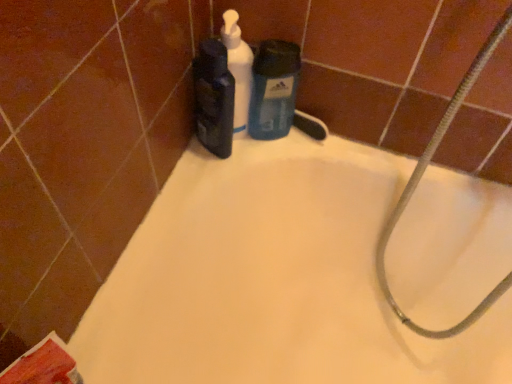
Question: Is white matte bathtub at upper center closer to camera compared to silvery metallic hose at upper right?

Choices:
 (A) no
 (B) yes

Answer: (A)

Question: From the image's perspective, is white matte bathtub at upper center located beneath silvery metallic hose at upper right?

Choices:
 (A) yes
 (B) no

Answer: (A)

Question: Does white matte bathtub at upper center touch silvery metallic hose at upper right?

Choices:
 (A) no
 (B) yes

Answer: (A)

Question: Could you tell me if white matte bathtub at upper center is turned towards silvery metallic hose at upper right?

Choices:
 (A) no
 (B) yes

Answer: (A)

Question: Is white matte bathtub at upper center outside of silvery metallic hose at upper right?

Choices:
 (A) yes
 (B) no

Answer: (A)

Question: From a real-world perspective, is white matte bathtub at upper center positioned above or below silvery metallic hose at upper right?

Choices:
 (A) below
 (B) above

Answer: (A)

Question: In terms of width, does white matte bathtub at upper center look wider or thinner when compared to silvery metallic hose at upper right?

Choices:
 (A) wide
 (B) thin

Answer: (A)

Question: Visually, is white matte bathtub at upper center positioned to the left or to the right of silvery metallic hose at upper right?

Choices:
 (A) left
 (B) right

Answer: (A)

Question: Which is correct: white matte bathtub at upper center is inside silvery metallic hose at upper right, or outside of it?

Choices:
 (A) inside
 (B) outside

Answer: (B)

Question: Looking at the image, does matte black bottle at upper center, acting as the first cleaning product starting from the left, seem bigger or smaller compared to white matte bathtub at upper center?

Choices:
 (A) big
 (B) small

Answer: (B)

Question: Is matte black bottle at upper center, the third cleaning product in the right-to-left sequence, to the left or to the right of white matte bathtub at upper center in the image?

Choices:
 (A) right
 (B) left

Answer: (B)

Question: Is matte black bottle at upper center, the third cleaning product in the right-to-left sequence, in front of or behind white matte bathtub at upper center in the image?

Choices:
 (A) behind
 (B) front

Answer: (A)

Question: From a real-world perspective, is matte black bottle at upper center, acting as the first cleaning product starting from the left, physically located above or below white matte bathtub at upper center?

Choices:
 (A) below
 (B) above

Answer: (B)

Question: From a real-world perspective, relative to matte black bottle at upper center, the third cleaning product in the right-to-left sequence, is white matte bathtub at upper center vertically above or below?

Choices:
 (A) above
 (B) below

Answer: (B)

Question: Considering the positions of white matte bathtub at upper center and matte black bottle at upper center, the third cleaning product in the right-to-left sequence, in the image, is white matte bathtub at upper center wider or thinner than matte black bottle at upper center, the third cleaning product in the right-to-left sequence,?

Choices:
 (A) wide
 (B) thin

Answer: (A)